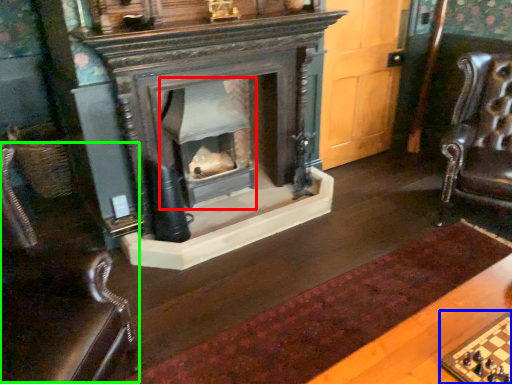
Question: Estimate the real-world distances between objects in this image. Which object is closer to fireplace (highlighted by a red box), board game (highlighted by a blue box) or rocking chair (highlighted by a green box)?

Choices:
 (A) board game
 (B) rocking chair

Answer: (B)